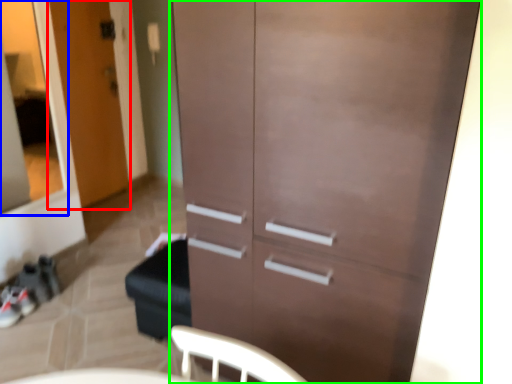
Question: Which object is the farthest from door (highlighted by a red box)? Choose among these: glass door (highlighted by a blue box) or cupboard (highlighted by a green box).

Choices:
 (A) glass door
 (B) cupboard

Answer: (B)